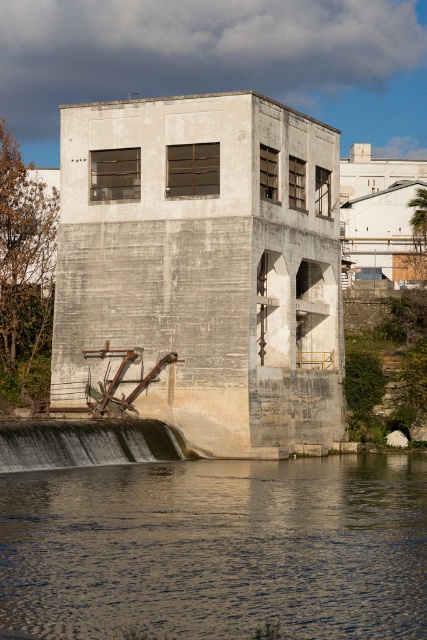
Question: Does clear water at lower center appear on the left side of gray concrete dam at lower left?

Choices:
 (A) yes
 (B) no

Answer: (B)

Question: Can you confirm if clear water at lower center is positioned above gray concrete dam at lower left?

Choices:
 (A) no
 (B) yes

Answer: (A)

Question: Which object is closer to the camera taking this photo?

Choices:
 (A) gray concrete dam at lower left
 (B) clear water at lower center

Answer: (B)

Question: Can you confirm if clear water at lower center is thinner than gray concrete dam at lower left?

Choices:
 (A) no
 (B) yes

Answer: (A)

Question: Which of the following is the farthest from the observer?

Choices:
 (A) (69, 436)
 (B) (256, 579)

Answer: (A)